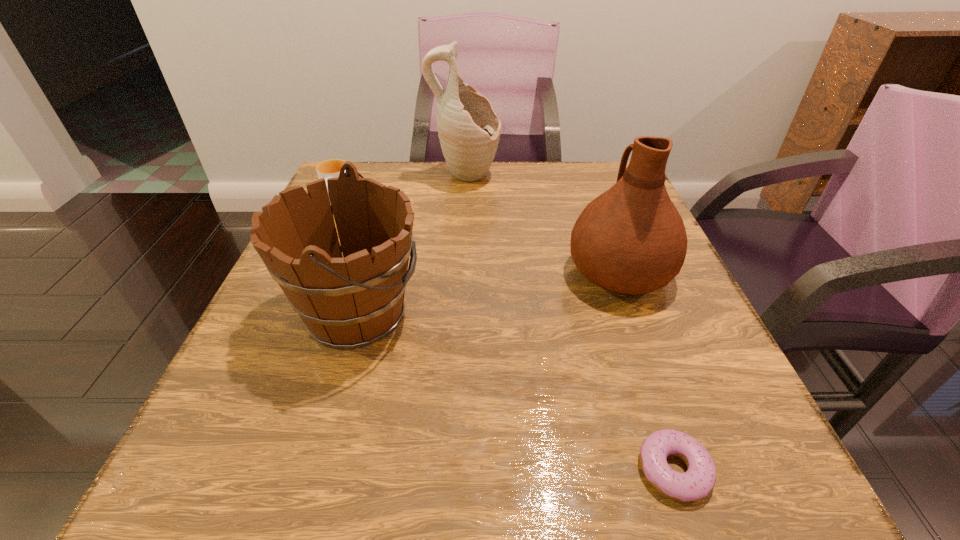
Where is `the farther pitcher`? the farther pitcher is located at coordinates (469, 130).

Identify the location of the left pitcher. Image resolution: width=960 pixels, height=540 pixels. (469, 130).

You are a GUI agent. You are given a task and a screenshot of the screen. Output one action in this format:
    pyautogui.click(x=<x>, y=<y>)
    Task: Click on the second tallest object
    
    Given the screenshot: What is the action you would take?
    coord(631,239)

Identify the location of the nearer pitcher. coord(631,239).

Find the location of `wine bucket`. wine bucket is located at coordinates (347, 303).

Image resolution: width=960 pixels, height=540 pixels. What are the coordinates of `cup` in the screenshot? It's located at (331, 168).

The width and height of the screenshot is (960, 540). Find the location of `the fourth tallest object`. the fourth tallest object is located at coordinates (331, 168).

The height and width of the screenshot is (540, 960). Identify the location of the shortest object. (698, 481).

The width and height of the screenshot is (960, 540). I want to click on the nearest object, so click(x=698, y=481).

Locate an element on the screen. The image size is (960, 540). vacant space located at the spout of the left pitcher is located at coordinates (x=588, y=177).